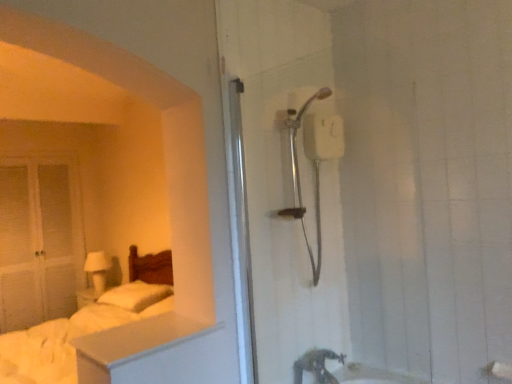
Question: Considering the relative sizes of white matte dresser at lower left and matte silver tap at lower center in the image provided, is white matte dresser at lower left shorter than matte silver tap at lower center?

Choices:
 (A) yes
 (B) no

Answer: (A)

Question: Is white matte dresser at lower left bigger than matte silver tap at lower center?

Choices:
 (A) no
 (B) yes

Answer: (B)

Question: Is white matte dresser at lower left looking in the opposite direction of matte silver tap at lower center?

Choices:
 (A) yes
 (B) no

Answer: (B)

Question: Does white matte dresser at lower left lie in front of matte silver tap at lower center?

Choices:
 (A) yes
 (B) no

Answer: (A)

Question: Is the position of white matte dresser at lower left more distant than that of matte silver tap at lower center?

Choices:
 (A) yes
 (B) no

Answer: (B)

Question: From the image's perspective, is white matte dresser at lower left under matte silver tap at lower center?

Choices:
 (A) no
 (B) yes

Answer: (A)

Question: From the image's perspective, is white soft pillow at left below white matte glass door at left?

Choices:
 (A) no
 (B) yes

Answer: (B)

Question: Does white soft pillow at left lie behind white matte glass door at left?

Choices:
 (A) no
 (B) yes

Answer: (A)

Question: Is white matte glass door at left at the back of white soft pillow at left?

Choices:
 (A) yes
 (B) no

Answer: (B)

Question: Can you confirm if white soft pillow at left is taller than white matte glass door at left?

Choices:
 (A) no
 (B) yes

Answer: (A)

Question: Could you tell me if white soft pillow at left is turned towards white matte glass door at left?

Choices:
 (A) yes
 (B) no

Answer: (B)

Question: Does white soft pillow at left have a larger size compared to white matte glass door at left?

Choices:
 (A) no
 (B) yes

Answer: (A)

Question: From a real-world perspective, does white soft pillow at left sit lower than white soft bed at left?

Choices:
 (A) yes
 (B) no

Answer: (B)